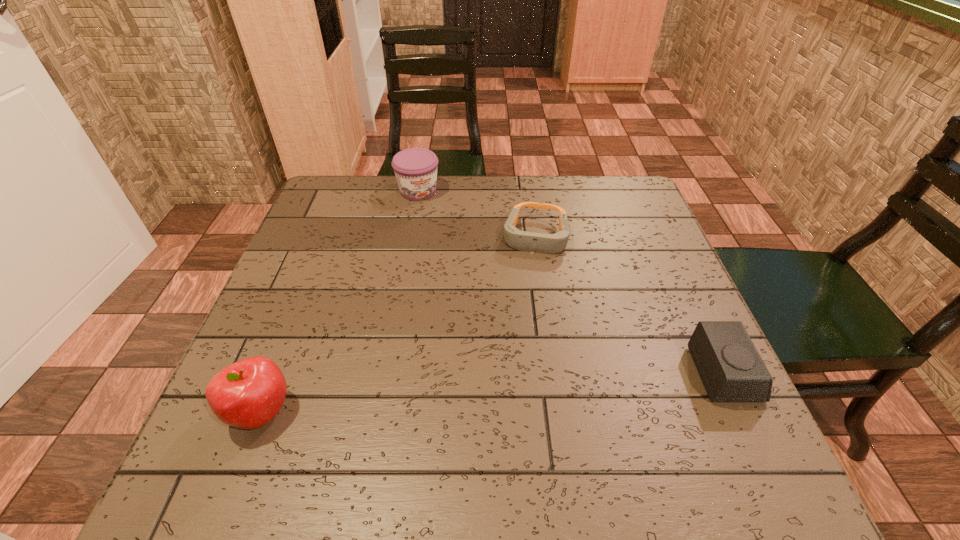
Locate an element on the screen. The image size is (960, 540). apple is located at coordinates (249, 393).

This screenshot has width=960, height=540. In order to click on the tallest object in this screenshot , I will do `click(249, 393)`.

What are the coordinates of `the second shortest object` in the screenshot? It's located at (731, 369).

Find the location of a particular element. The height and width of the screenshot is (540, 960). alarm clock is located at coordinates (731, 369).

Locate an element on the screen. the shortest object is located at coordinates (521, 240).

In order to click on the third nearest object in this screenshot , I will do `click(521, 240)`.

Locate an element on the screen. The height and width of the screenshot is (540, 960). jam is located at coordinates (415, 169).

At what (x,y) coordinates should I click in order to perform the action: click on the second object from left to right. Please return your answer as a coordinate pair (x, y). Looking at the image, I should click on (415, 169).

Where is `blank area located 0.380m on the right of the leftmost object`? The image size is (960, 540). blank area located 0.380m on the right of the leftmost object is located at coordinates (514, 412).

At what (x,y) coordinates should I click in order to perform the action: click on vacant space located 0.150m on the front and back of the goggles. Please return your answer as a coordinate pair (x, y). Looking at the image, I should click on (524, 308).